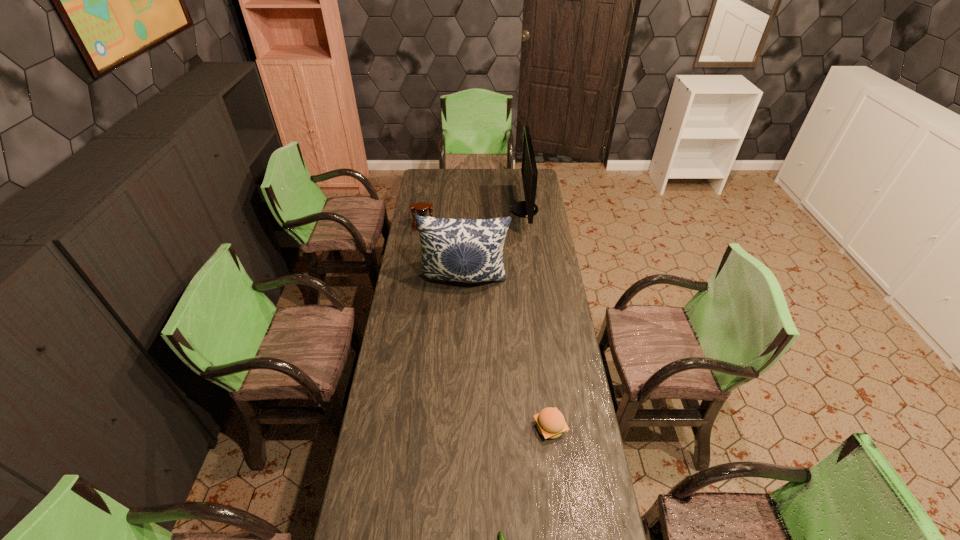
You are a GUI agent. You are given a task and a screenshot of the screen. Output one action in this format:
    pyautogui.click(x=<x>, y=<y>)
    Task: Click on the computer monitor
    This screenshot has width=960, height=540.
    Given the screenshot: What is the action you would take?
    pyautogui.click(x=528, y=208)

Find the location of a particular element. This screenshot has width=960, height=540. the third farthest object is located at coordinates (465, 250).

The height and width of the screenshot is (540, 960). I want to click on the third tallest object, so click(421, 208).

Find the location of a particular element. The width and height of the screenshot is (960, 540). the fourth tallest object is located at coordinates (551, 424).

You are a GUI agent. You are given a task and a screenshot of the screen. Output one action in this format:
    pyautogui.click(x=<x>, y=<y>)
    Task: Click on the second nearest object
    
    Given the screenshot: What is the action you would take?
    pyautogui.click(x=551, y=424)

This screenshot has width=960, height=540. Identify the location of free space located on the front-facing side of the computer monitor. (442, 210).

Where is `vacant space located 0.350m on the front-facing side of the computer monitor`? vacant space located 0.350m on the front-facing side of the computer monitor is located at coordinates (448, 210).

I want to click on vacant space located 0.210m on the front-facing side of the computer monitor, so click(x=473, y=210).

At what (x,y) coordinates should I click in order to perform the action: click on free space located on the front surface of the third nearest object. Please return your answer as a coordinate pair (x, y). The height and width of the screenshot is (540, 960). Looking at the image, I should click on (462, 354).

This screenshot has height=540, width=960. I want to click on free space located 0.360m on the right of the hourglass, so tap(502, 228).